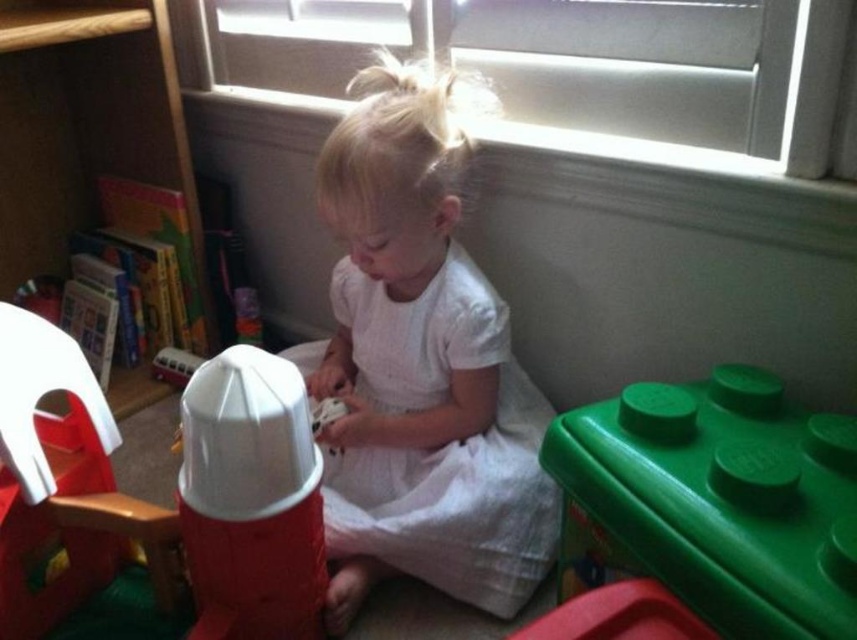
Question: Is green plastic container at lower right smaller than wooden bookshelf at left?

Choices:
 (A) no
 (B) yes

Answer: (B)

Question: Which object is positioned closest to the green plastic container at lower right?

Choices:
 (A) wooden bookshelf at left
 (B) white cotton dress at center

Answer: (B)

Question: Can you confirm if green plastic container at lower right is wider than wooden bookshelf at left?

Choices:
 (A) no
 (B) yes

Answer: (A)

Question: Where is white cotton dress at center located in relation to wooden bookshelf at left in the image?

Choices:
 (A) left
 (B) right

Answer: (B)

Question: Estimate the real-world distances between objects in this image. Which object is farther from the green plastic container at lower right?

Choices:
 (A) wooden bookshelf at left
 (B) white cotton dress at center

Answer: (A)

Question: Which object is the closest to the white cotton dress at center?

Choices:
 (A) wooden bookshelf at left
 (B) green plastic container at lower right

Answer: (B)